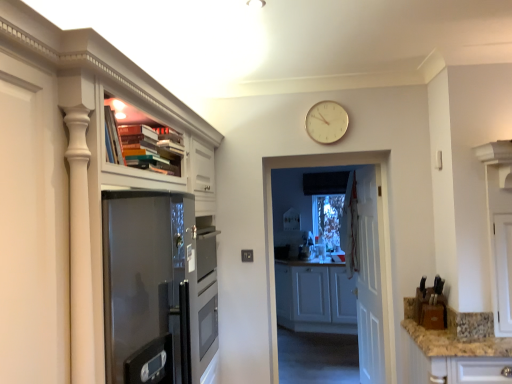
Question: Does matte white cabinet at upper left, acting as the 2th cabinetry starting from the right, have a lesser width compared to white glossy door at center?

Choices:
 (A) no
 (B) yes

Answer: (A)

Question: Is matte white cabinet at upper left, acting as the 1th cabinetry starting from the front, bigger than white glossy door at center?

Choices:
 (A) no
 (B) yes

Answer: (B)

Question: From the image's perspective, is matte white cabinet at upper left, acting as the 1th cabinetry starting from the front, over white glossy door at center?

Choices:
 (A) no
 (B) yes

Answer: (B)

Question: Does matte white cabinet at upper left, acting as the 2th cabinetry starting from the right, turn towards white glossy door at center?

Choices:
 (A) yes
 (B) no

Answer: (A)

Question: Considering the relative sizes of matte white cabinet at upper left, acting as the 1th cabinetry starting from the front, and white glossy door at center in the image provided, is matte white cabinet at upper left, acting as the 1th cabinetry starting from the front, taller than white glossy door at center?

Choices:
 (A) no
 (B) yes

Answer: (B)

Question: From the image's perspective, relative to white glossy door at center, is gold metallic clock at upper center above or below?

Choices:
 (A) above
 (B) below

Answer: (A)

Question: Considering the positions of gold metallic clock at upper center and white glossy door at center in the image, is gold metallic clock at upper center wider or thinner than white glossy door at center?

Choices:
 (A) thin
 (B) wide

Answer: (A)

Question: Is point (332, 122) closer or farther from the camera than point (381, 213)?

Choices:
 (A) farther
 (B) closer

Answer: (B)

Question: In terms of size, does gold metallic clock at upper center appear bigger or smaller than white glossy door at center?

Choices:
 (A) big
 (B) small

Answer: (B)

Question: Would you say matte white cabinet at upper left, acting as the 1th cabinetry starting from the front, is inside or outside white glossy door at center?

Choices:
 (A) inside
 (B) outside

Answer: (B)

Question: Relative to white glossy door at center, is matte white cabinet at upper left, acting as the 1th cabinetry starting from the front, in front or behind?

Choices:
 (A) front
 (B) behind

Answer: (A)

Question: From the image's perspective, is matte white cabinet at upper left, acting as the 1th cabinetry starting from the front, above or below white glossy door at center?

Choices:
 (A) below
 (B) above

Answer: (B)

Question: Considering the positions of matte white cabinet at upper left, the 1th cabinetry from the left, and white glossy door at center in the image, is matte white cabinet at upper left, the 1th cabinetry from the left, bigger or smaller than white glossy door at center?

Choices:
 (A) big
 (B) small

Answer: (A)

Question: Looking at their shapes, would you say white glossy door at center is wider or thinner than granite countertop at lower right?

Choices:
 (A) wide
 (B) thin

Answer: (A)

Question: Which is correct: white glossy door at center is inside granite countertop at lower right, or outside of it?

Choices:
 (A) inside
 (B) outside

Answer: (B)